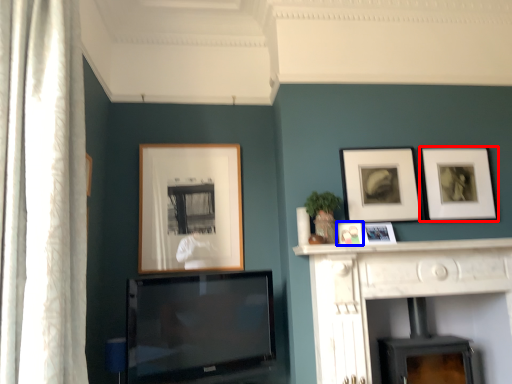
Question: Which object appears closest to the camera in this image, picture frame (highlighted by a red box) or picture frame (highlighted by a blue box)?

Choices:
 (A) picture frame
 (B) picture frame

Answer: (B)